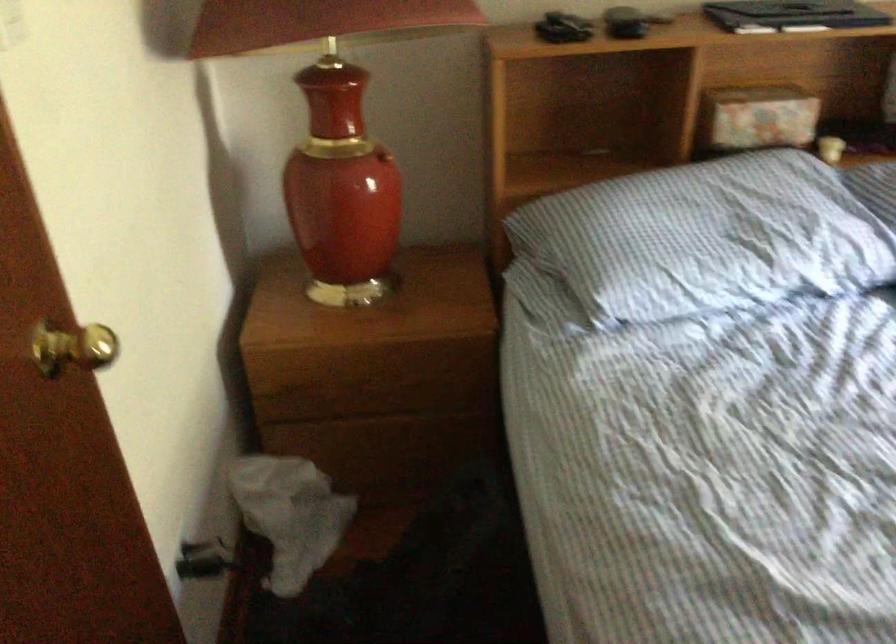
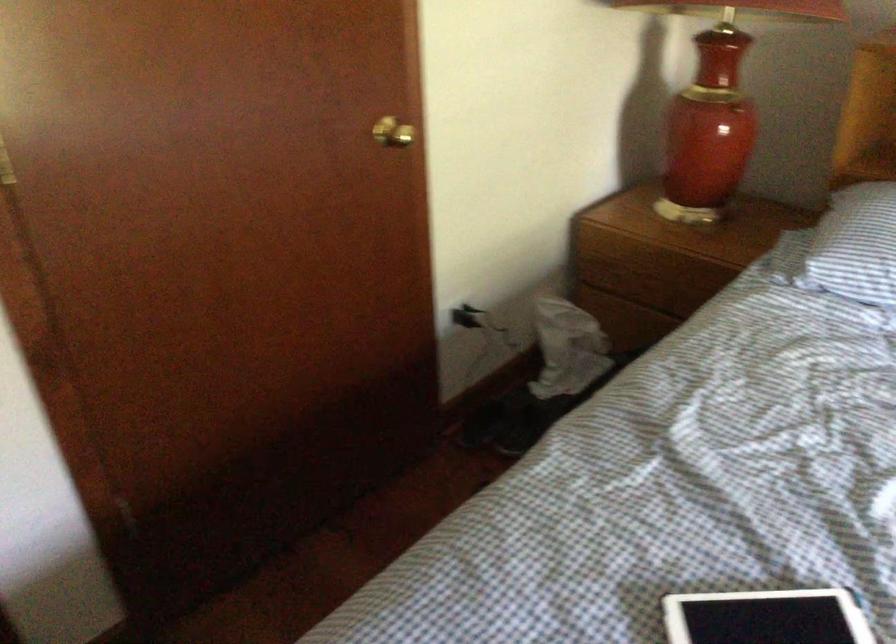
Locate, in the second image, the point that corresponds to [373,393] in the first image.

(650, 283)